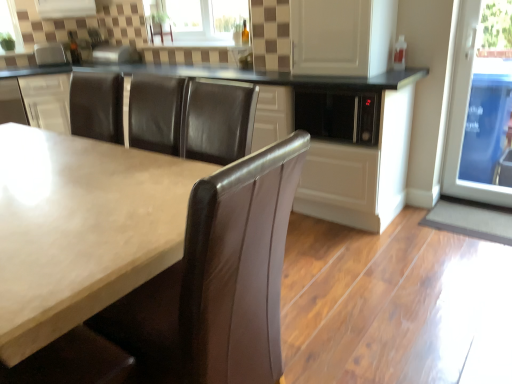
Question: Can you confirm if matte black microwave at center, the first cabinetry viewed from the right, is shorter than white glossy cabinet at center, the 2th cabinetry when ordered from right to left?

Choices:
 (A) yes
 (B) no

Answer: (B)

Question: Are matte black microwave at center, which is the second cabinetry from left to right, and white glossy cabinet at center, the 1th cabinetry from the left, far apart?

Choices:
 (A) no
 (B) yes

Answer: (B)

Question: From the image's perspective, is matte black microwave at center, which is the second cabinetry from left to right, over white glossy cabinet at center, the 2th cabinetry when ordered from right to left?

Choices:
 (A) no
 (B) yes

Answer: (A)

Question: Does matte black microwave at center, which is the second cabinetry from left to right, have a greater width compared to white glossy cabinet at center, the 1th cabinetry from the left?

Choices:
 (A) no
 (B) yes

Answer: (A)

Question: Does matte black microwave at center, the first cabinetry viewed from the right, have a smaller size compared to white glossy cabinet at center, the 2th cabinetry when ordered from right to left?

Choices:
 (A) yes
 (B) no

Answer: (B)

Question: From the image's perspective, is matte black microwave at center, which is the second cabinetry from left to right, located beneath white glossy cabinet at center, the 1th cabinetry from the left?

Choices:
 (A) yes
 (B) no

Answer: (A)

Question: Would you say clear glass window at upper center is a long distance from satin silver toaster at upper left?

Choices:
 (A) yes
 (B) no

Answer: (A)

Question: Does clear glass window at upper center have a larger size compared to satin silver toaster at upper left?

Choices:
 (A) yes
 (B) no

Answer: (A)

Question: Considering the relative sizes of clear glass window at upper center and satin silver toaster at upper left in the image provided, is clear glass window at upper center smaller than satin silver toaster at upper left?

Choices:
 (A) no
 (B) yes

Answer: (A)

Question: Is clear glass window at upper center facing away from satin silver toaster at upper left?

Choices:
 (A) yes
 (B) no

Answer: (B)

Question: Is clear glass window at upper center oriented towards satin silver toaster at upper left?

Choices:
 (A) no
 (B) yes

Answer: (A)

Question: From the image's perspective, is clear glass window at upper center beneath satin silver toaster at upper left?

Choices:
 (A) yes
 (B) no

Answer: (B)

Question: Can you confirm if white glossy cabinet at upper center is thinner than satin silver toaster at upper left?

Choices:
 (A) no
 (B) yes

Answer: (A)